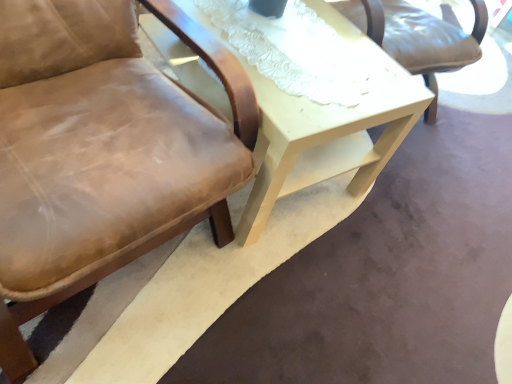
This screenshot has height=384, width=512. In order to click on brown leather chair at left in this screenshot , I will do `click(103, 152)`.

This screenshot has height=384, width=512. Describe the element at coordinates (103, 152) in the screenshot. I see `brown leather chair at left` at that location.

What are the coordinates of `light beige wood table at center` in the screenshot? It's located at (323, 126).

What do you see at coordinates (323, 126) in the screenshot?
I see `light beige wood table at center` at bounding box center [323, 126].

You are a GUI agent. You are given a task and a screenshot of the screen. Output one action in this format:
    pyautogui.click(x=<x>, y=<y>)
    Task: Click on the brown leather chair at left
    
    Given the screenshot: What is the action you would take?
    pyautogui.click(x=103, y=152)

Considering the relative positions of light beige wood table at center and brown leather chair at left in the image provided, is light beige wood table at center to the left or to the right of brown leather chair at left?

In the image, light beige wood table at center appears on the right side of brown leather chair at left.

Relative to brown leather chair at left, is light beige wood table at center in front or behind?

light beige wood table at center is behind brown leather chair at left.

Does point (285, 117) come behind point (39, 266)?

That is True.

From the image's perspective, which one is positioned lower, light beige wood table at center or brown leather chair at left?

brown leather chair at left.

From a real-world perspective, which object rests below the other?

light beige wood table at center, from a real-world perspective.

In terms of width, does light beige wood table at center look wider or thinner when compared to brown leather chair at left?

In the image, light beige wood table at center appears to be wider than brown leather chair at left.

Does light beige wood table at center have a lesser height compared to brown leather chair at left?

Yes.

Considering the sizes of objects light beige wood table at center and brown leather chair at left in the image provided, who is bigger, light beige wood table at center or brown leather chair at left?

Bigger between the two is brown leather chair at left.

Is light beige wood table at center situated inside brown leather chair at left or outside?

light beige wood table at center is located beyond the bounds of brown leather chair at left.

Based on the photo, is light beige wood table at center far away from brown leather chair at left?

No.

Could you tell me if light beige wood table at center is facing brown leather chair at left?

No, light beige wood table at center is not oriented towards brown leather chair at left.

You are a GUI agent. You are given a task and a screenshot of the screen. Output one action in this format:
    pyautogui.click(x=<x>, y=<y>)
    Task: Click on the chair lying in front of the light beige wood table at center
    The height and width of the screenshot is (384, 512).
    Given the screenshot: What is the action you would take?
    pyautogui.click(x=103, y=152)

Is brown leather chair at left to the right of light beige wood table at center from the viewer's perspective?

Incorrect, brown leather chair at left is not on the right side of light beige wood table at center.

Which is in front, brown leather chair at left or light beige wood table at center?

Positioned in front is brown leather chair at left.

Which point is more forward, (19, 119) or (289, 181)?

The point (19, 119) is closer.

From the image's perspective, does brown leather chair at left appear higher than light beige wood table at center?

Incorrect, from the image's perspective, brown leather chair at left is lower than light beige wood table at center.

From a real-world perspective, is brown leather chair at left positioned under light beige wood table at center based on gravity?

No.

Between brown leather chair at left and light beige wood table at center, which one has smaller width?

With smaller width is brown leather chair at left.

Who is shorter, brown leather chair at left or light beige wood table at center?

Standing shorter between the two is light beige wood table at center.

From the picture: Considering the sizes of objects brown leather chair at left and light beige wood table at center in the image provided, who is smaller, brown leather chair at left or light beige wood table at center?

light beige wood table at center is smaller.

Is brown leather chair at left inside or outside of light beige wood table at center?

The correct answer is: outside.

Based on the photo, is brown leather chair at left with light beige wood table at center?

They are not placed beside each other.

Is brown leather chair at left positioned with its back to light beige wood table at center?

No, brown leather chair at left is not facing the opposite direction of light beige wood table at center.

Locate an element on the screen. Image resolution: width=512 pixels, height=384 pixels. table that appears on the right of brown leather chair at left is located at coordinates (323, 126).

Identify the location of table beneath the brown leather chair at left (from a real-world perspective). (x=323, y=126).

I want to click on table that is on the right side of brown leather chair at left, so click(323, 126).